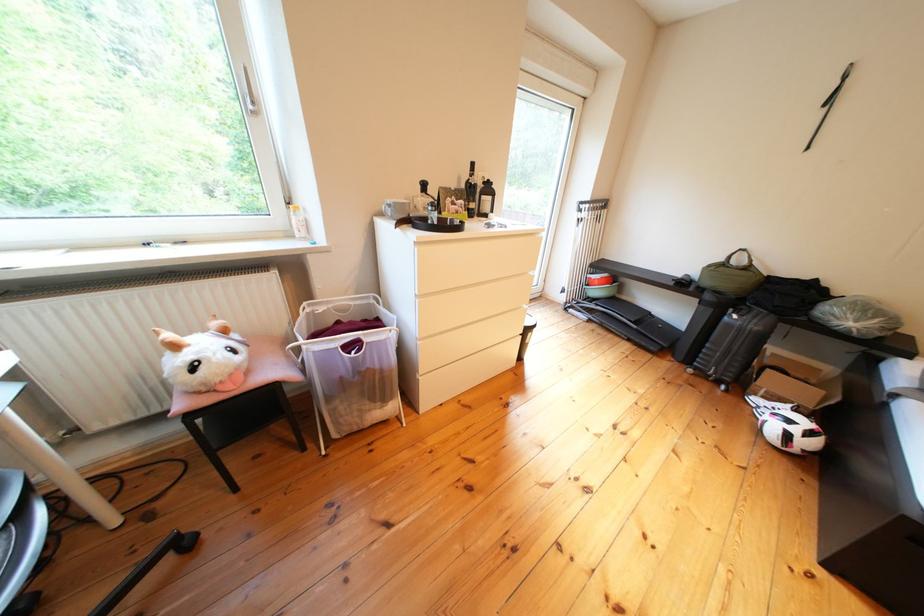
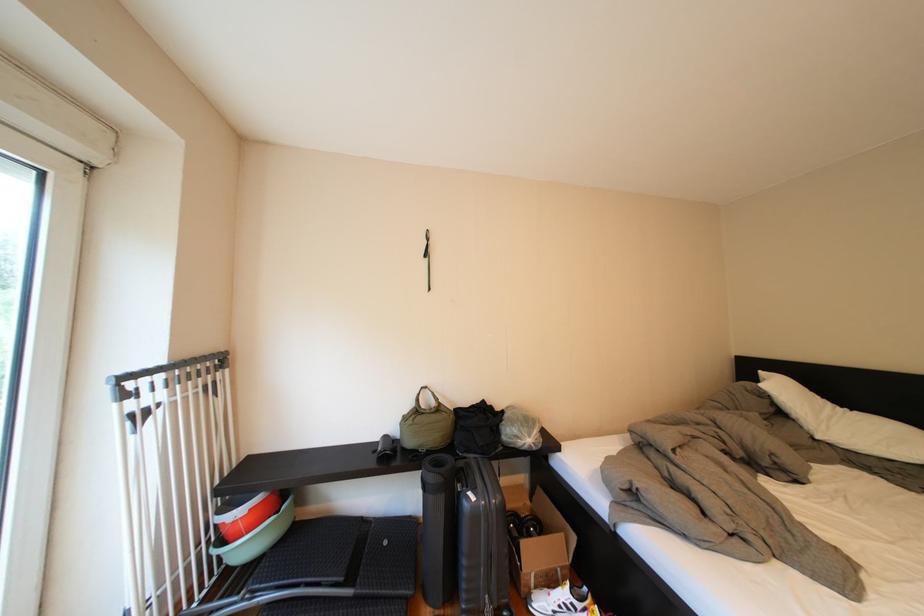
Find the pixel in the second image that matches pixel 614 209 in the first image.

(224, 369)